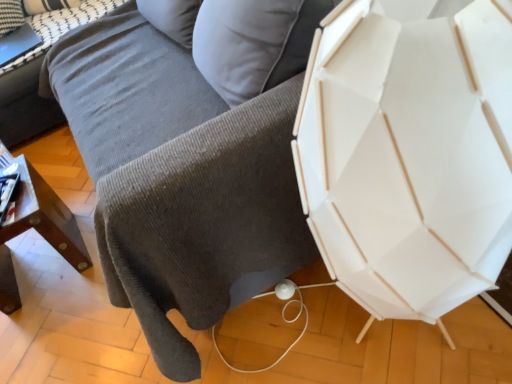
Question: Considering the relative sizes of white textured pillow at upper left and gray corduroy couch at upper left in the image provided, is white textured pillow at upper left smaller than gray corduroy couch at upper left?

Choices:
 (A) yes
 (B) no

Answer: (A)

Question: From the image's perspective, is white textured pillow at upper left on top of gray corduroy couch at upper left?

Choices:
 (A) no
 (B) yes

Answer: (B)

Question: From the image's perspective, does white textured pillow at upper left appear lower than gray corduroy couch at upper left?

Choices:
 (A) yes
 (B) no

Answer: (B)

Question: From a real-world perspective, does white textured pillow at upper left sit lower than gray corduroy couch at upper left?

Choices:
 (A) no
 (B) yes

Answer: (A)

Question: Are white textured pillow at upper left and gray corduroy couch at upper left located far from each other?

Choices:
 (A) yes
 (B) no

Answer: (B)

Question: Is point (17, 225) positioned closer to the camera than point (86, 8)?

Choices:
 (A) closer
 (B) farther

Answer: (A)

Question: From a real-world perspective, is wooden table at lower left above or below white textured pillow at upper left?

Choices:
 (A) above
 (B) below

Answer: (B)

Question: From their relative heights in the image, would you say wooden table at lower left is taller or shorter than white textured pillow at upper left?

Choices:
 (A) short
 (B) tall

Answer: (B)

Question: Based on their positions, is wooden table at lower left located to the left or right of white textured pillow at upper left?

Choices:
 (A) left
 (B) right

Answer: (B)

Question: Is wooden table at lower left wider or thinner than gray corduroy couch at center?

Choices:
 (A) wide
 (B) thin

Answer: (B)

Question: In the image, is wooden table at lower left positioned in front of or behind gray corduroy couch at center?

Choices:
 (A) front
 (B) behind

Answer: (B)

Question: In the image, is wooden table at lower left on the left side or the right side of gray corduroy couch at center?

Choices:
 (A) left
 (B) right

Answer: (A)

Question: Considering the positions of wooden table at lower left and gray corduroy couch at center in the image, is wooden table at lower left taller or shorter than gray corduroy couch at center?

Choices:
 (A) short
 (B) tall

Answer: (A)

Question: Considering the positions of wooden table at lower left and gray corduroy couch at upper left in the image, is wooden table at lower left wider or thinner than gray corduroy couch at upper left?

Choices:
 (A) thin
 (B) wide

Answer: (A)

Question: Considering the relative positions of wooden table at lower left and gray corduroy couch at upper left in the image provided, is wooden table at lower left to the left or to the right of gray corduroy couch at upper left?

Choices:
 (A) left
 (B) right

Answer: (B)